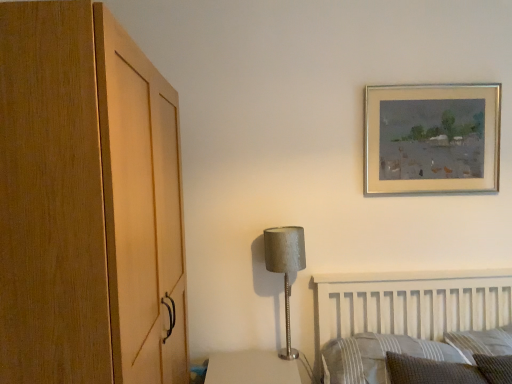
Image resolution: width=512 pixels, height=384 pixels. Find the location of `free space above satin silver lamp at center (from a real-world perspective)`. free space above satin silver lamp at center (from a real-world perspective) is located at coordinates (280, 232).